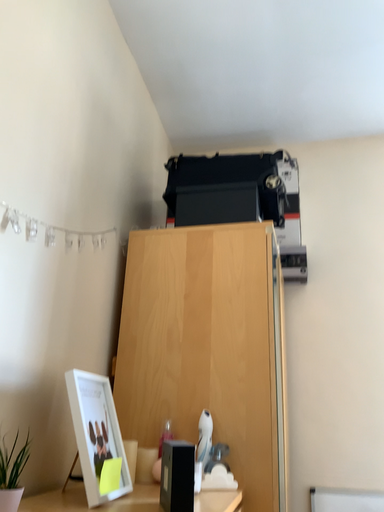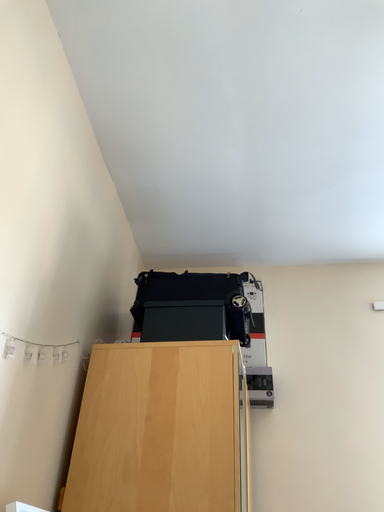
Question: How did the camera likely rotate when shooting the video?

Choices:
 (A) rotated upward
 (B) rotated downward

Answer: (A)